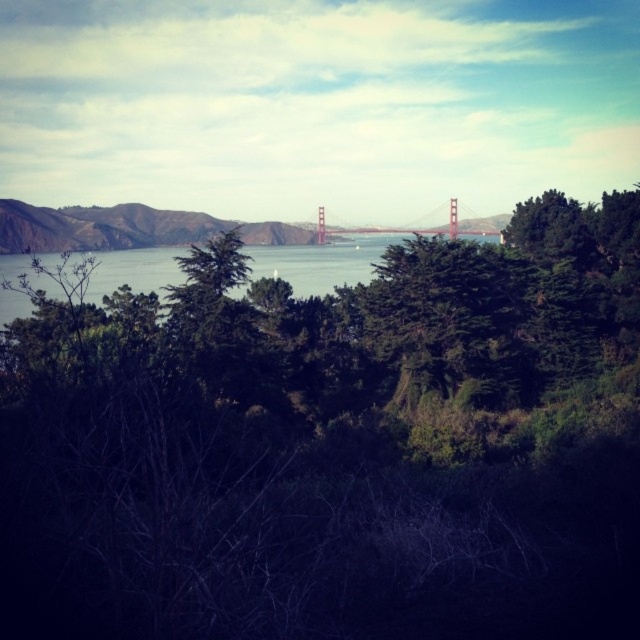
Which is above, blue water at center or metallic golden bridge at center?

Positioned higher is metallic golden bridge at center.

Identify the location of blue water at center. (321, 262).

Who is more distant from viewer, (166,253) or (490,234)?

Point (490,234)

Identify the location of blue water at center. Image resolution: width=640 pixels, height=640 pixels. (321, 262).

Is point (8, 561) closer to viewer compared to point (259, 262)?

Yes, it is in front of point (259, 262).

Does green leafy tree at center have a lesser height compared to blue water at center?

In fact, green leafy tree at center may be taller than blue water at center.

Between point (444, 424) and point (4, 304), which one is positioned in front?

Point (444, 424) is more forward.

You are a GUI agent. You are given a task and a screenshot of the screen. Output one action in this format:
    pyautogui.click(x=<x>, y=<y>)
    Task: Click on the green leafy tree at center
    The width and height of the screenshot is (640, 640).
    Given the screenshot: What is the action you would take?
    pyautogui.click(x=336, y=445)

Is point (76, 481) farther from camera compared to point (368, 227)?

No, (76, 481) is in front of (368, 227).

Find the location of a particular element. This screenshot has width=640, height=640. green leafy tree at center is located at coordinates (336, 445).